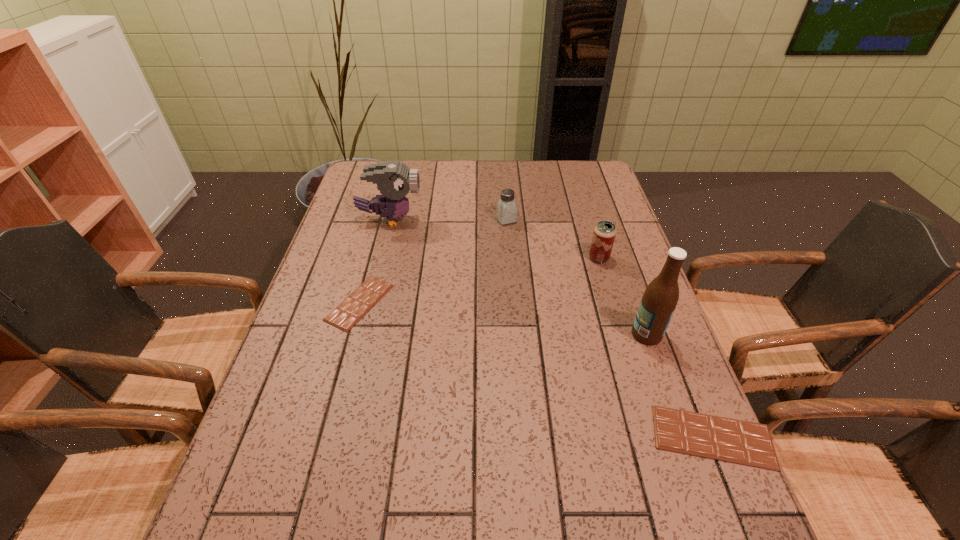
Where is `vacant space located on the right of the saltshaker`? This screenshot has width=960, height=540. vacant space located on the right of the saltshaker is located at coordinates (607, 220).

What are the coordinates of `free spot located 0.130m at the beak of the fifth shortest object` in the screenshot? It's located at (463, 219).

Locate an element on the screen. vacant point located 0.200m on the back of the fourth nearest object is located at coordinates (586, 213).

Image resolution: width=960 pixels, height=540 pixels. In order to click on vacant space located 0.280m on the front of the beer bottle in this screenshot , I will do `click(692, 463)`.

I want to click on object that is positioned at the near edge, so click(730, 440).

The height and width of the screenshot is (540, 960). Find the location of `chocolate bar present at the left edge`. chocolate bar present at the left edge is located at coordinates (362, 299).

Where is `bird located at the left edge`? The width and height of the screenshot is (960, 540). bird located at the left edge is located at coordinates (x=394, y=179).

Identify the location of chocolate bar situated at the right edge. The image size is (960, 540). (730, 440).

Find the location of a particular element. beer can situated at the right edge is located at coordinates (604, 234).

At what (x,y) coordinates should I click in order to perform the action: click on beer bottle at the right edge. Please return your answer as a coordinate pair (x, y). This screenshot has height=540, width=960. Looking at the image, I should click on (660, 298).